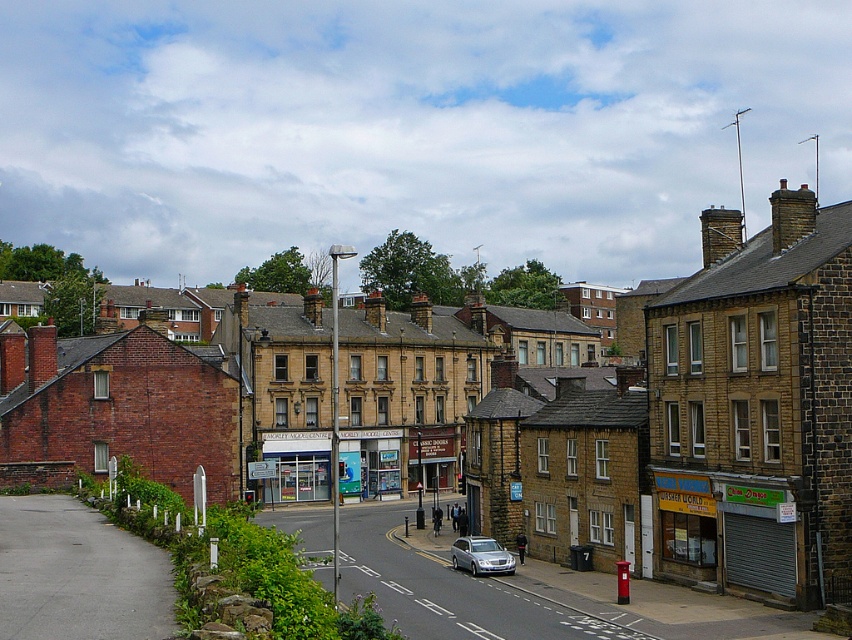
You are a pedestrian standing on the sidewalk and want to cross the street to reach the brown brick building at center. Is the silver metallic car at center blocking your path?

The brown brick building at center is in front of the silver metallic car at center, so the car is behind the building and not blocking your path. You can safely cross to the building.

You are standing at point (755, 406) in the urban street scene. What type of building is located exactly at your current position?

The brown brick building at center is located exactly at point (755, 406).

You are a delivery person who needs to park your 2.5 meter wide truck between the brown brick building at center and the silver metallic car at center. Is there enough space between them for your truck?

The brown brick building at center might be wider than the silver metallic car at center, so there may not be enough space for the truck to park between them. It is uncertain and requires further measurement.